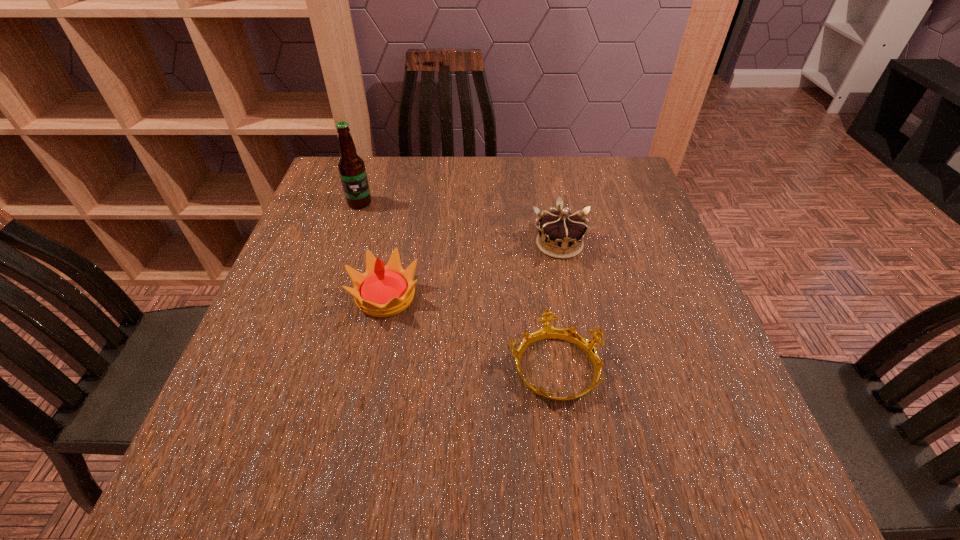
Locate which object ranks second in proximity to the farthest crown. Please provide its 2D coordinates. Your answer should be formatted as a tuple, i.e. [(x, y)], where the tuple contains the x and y coordinates of a point satisfying the conditions above.

[(382, 291)]

Select which crown is the second closest to the farthest object. Please provide its 2D coordinates. Your answer should be formatted as a tuple, i.e. [(x, y)], where the tuple contains the x and y coordinates of a point satisfying the conditions above.

[(561, 234)]

Select which crown appears as the closest to the shortest object. Please provide its 2D coordinates. Your answer should be formatted as a tuple, i.e. [(x, y)], where the tuple contains the x and y coordinates of a point satisfying the conditions above.

[(382, 291)]

Locate an element on the screen. This screenshot has height=540, width=960. free space in the image that satisfies the following two spatial constraints: 1. on the label of the shortest object; 2. on the right side of the farthest object is located at coordinates (306, 367).

This screenshot has height=540, width=960. Identify the location of free space in the image that satisfies the following two spatial constraints: 1. on the label of the farthest object; 2. on the left side of the farthest crown. (347, 244).

Image resolution: width=960 pixels, height=540 pixels. What are the coordinates of `vacant space that satisfies the following two spatial constraints: 1. on the back side of the nearest crown; 2. on the left side of the farthest crown` in the screenshot? It's located at (538, 244).